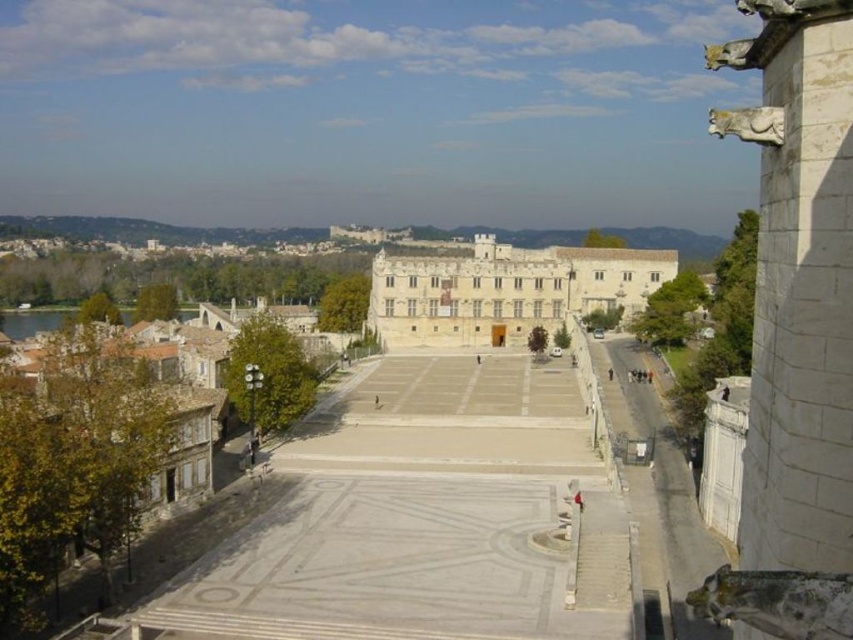
You are an architect visiting the historic square and want to take a photo of both the white stone gargoyle at right and the white stone palace at center. Since you want both to be clearly visible in the photo, which object should you position closer to the camera to ensure the smaller one isn

The white stone gargoyle at right is larger in size than the white stone palace at center. Therefore, to ensure both are clearly visible, you should position the white stone palace at center closer to the camera since it is smaller and might be less visible if farther away.

You are standing in the historic square and want to take a photo of the white stone gargoyle at right. If your camera has a maximum focus range of 35 meters, will it be able to capture the gargoyle clearly?

The white stone gargoyle at right is 34.84 meters away from the viewer. Since the camera can focus up to 35 meters, it should be able to capture the gargoyle clearly within this range.

You are an architect visiting the historic square and want to take a photo of the white stone gargoyle at right and the white stone palace at center. Which object is closer to the camera if you are standing at the entrance of the square?

The white stone gargoyle at right is positioned under the white stone palace at center, so if you are standing at the entrance of the square, the white stone palace at center is closer to the camera because it is above the gargoyle.